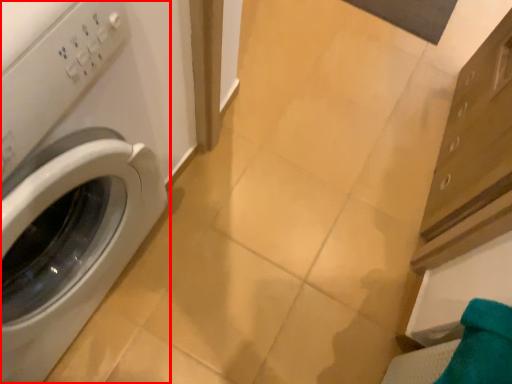
Question: From the image's perspective, what is the correct spatial positioning of washing machine (annotated by the red box) in reference to bath towel?

Choices:
 (A) above
 (B) below

Answer: (A)